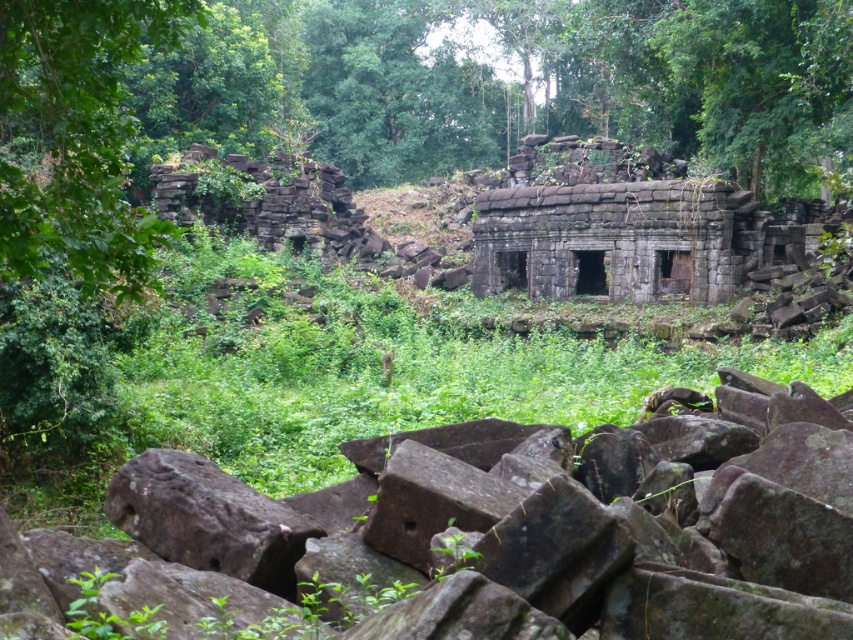
Consider the image. You are an archaeologist examining the ancient stone structure. You notice the gray rough stone at center and the green leafy tree at left. Which object is positioned lower in the image?

The gray rough stone at center is below the green leafy tree at left, so it is positioned lower in the image.